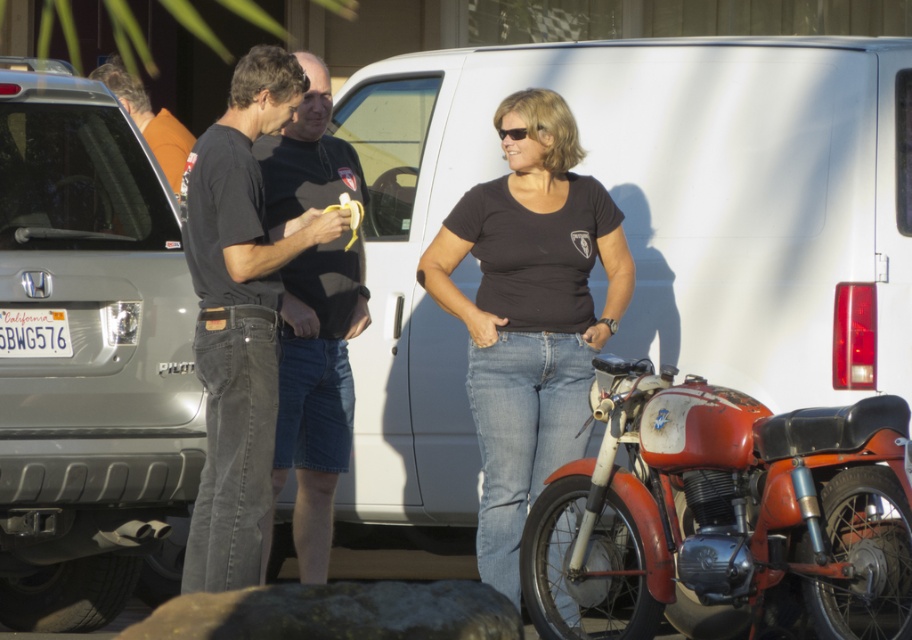
You are a photographer trying to capture a clear shot of the black cotton shirt at center without the rusty metal motorcycle at lower right blocking it. Given their relative sizes, is it possible to frame the shot so that the motorcycle doesn not cover the shirt?

The rusty metal motorcycle at lower right is wider than the black cotton shirt at center. Therefore, it might be challenging to frame the shot without the motorcycle overlapping the shirt, especially if they are positioned close to each other in the scene.

You are standing in the parking area looking at the scene. There are two points marked in the image. Which point, point (486, 563) or point (173, 188), is closer to you?

Point (486, 563) is closer to the viewer than point (173, 188).

You are a photographer trying to capture a clear shot of the black cotton shirt at center without the rusty metal motorcycle at lower right blocking it. Can you adjust your position so that the motorcycle is entirely out of the frame while still keeping the shirt in view?

The rusty metal motorcycle at lower right has a lesser height compared to the black cotton shirt at center. Since the motorcycle is shorter, you can lower your camera angle to position the shirt within the frame while keeping the motorcycle out of sight below the frame edge.